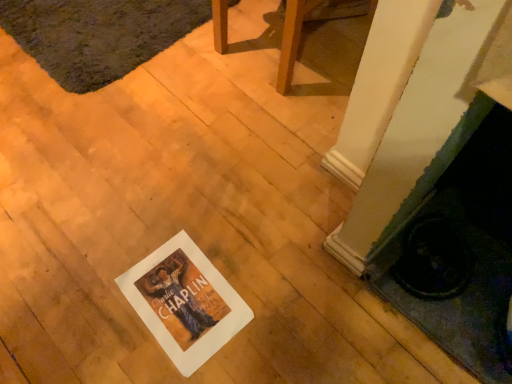
Identify the location of vacant space to the left of white paper at center. (94, 299).